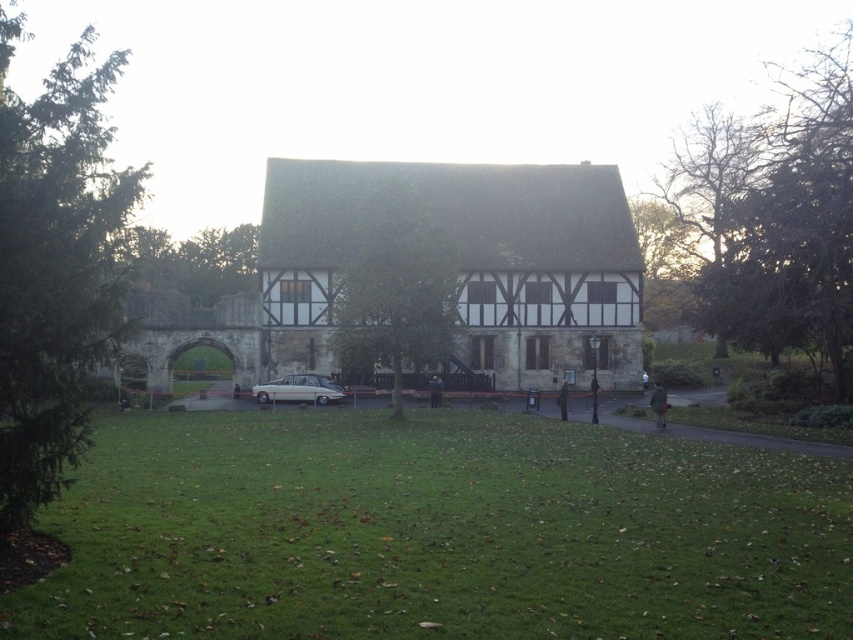
You are a photographer planning to take a photo of the vintage car parked in front of the traditional half timbered building. However, two jackets are blocking the view. The dark blue jacket at center and the dark brown leather jacket at center are in the way. Which jacket is closer to the camera so you can decide to move it first?

The dark blue jacket at center is closer to the camera because the dark brown leather jacket at center is behind it, so you should move the dark blue jacket at center first to clear the view.